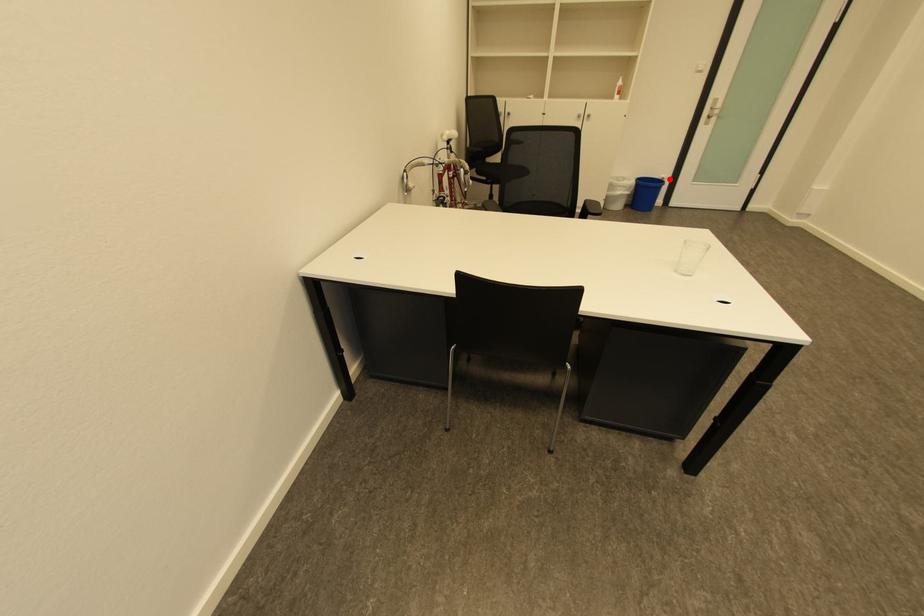
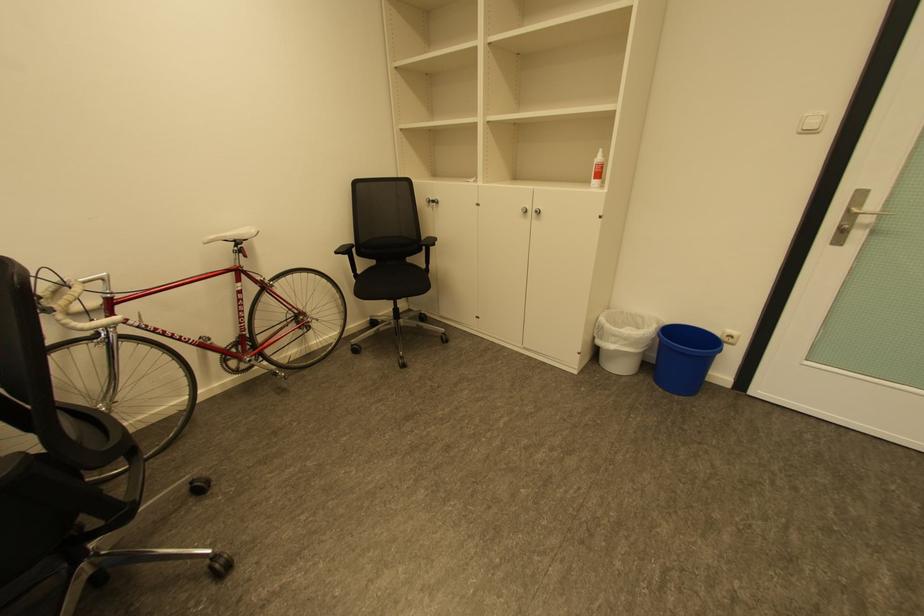
Locate, in the second image, the point that corresponds to the highlighted location in the first image.

(737, 337)